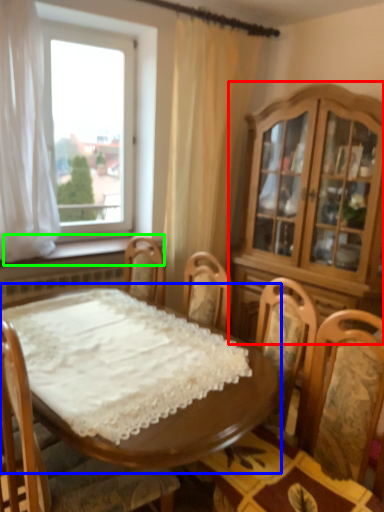
Question: Which object is positioned farthest from cabinetry (highlighted by a red box)? Select from table (highlighted by a blue box) and window sill (highlighted by a green box).

Choices:
 (A) table
 (B) window sill

Answer: (B)